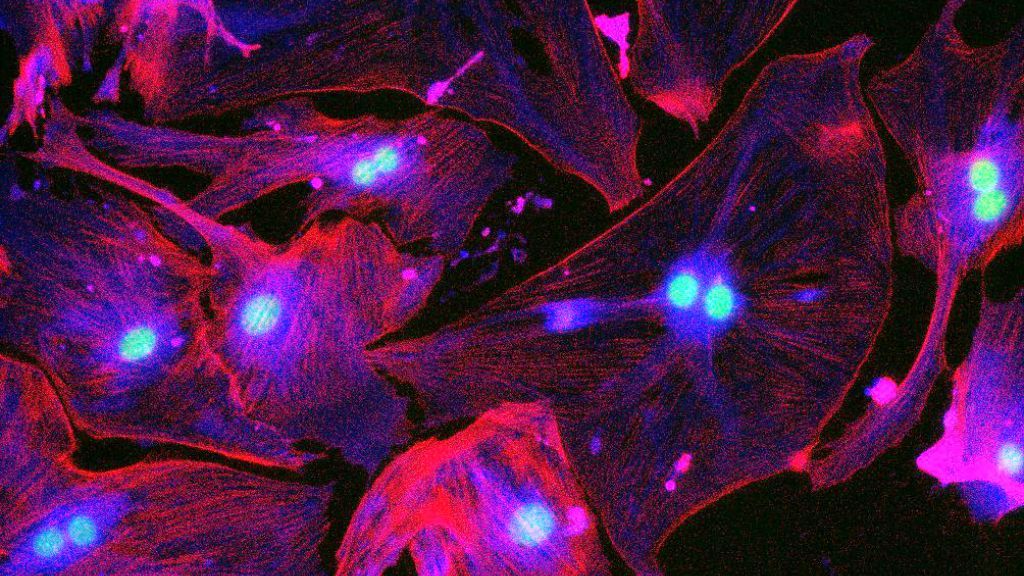
I want to click on blue round light, center bottom of image, so click(x=522, y=526), click(x=545, y=526).